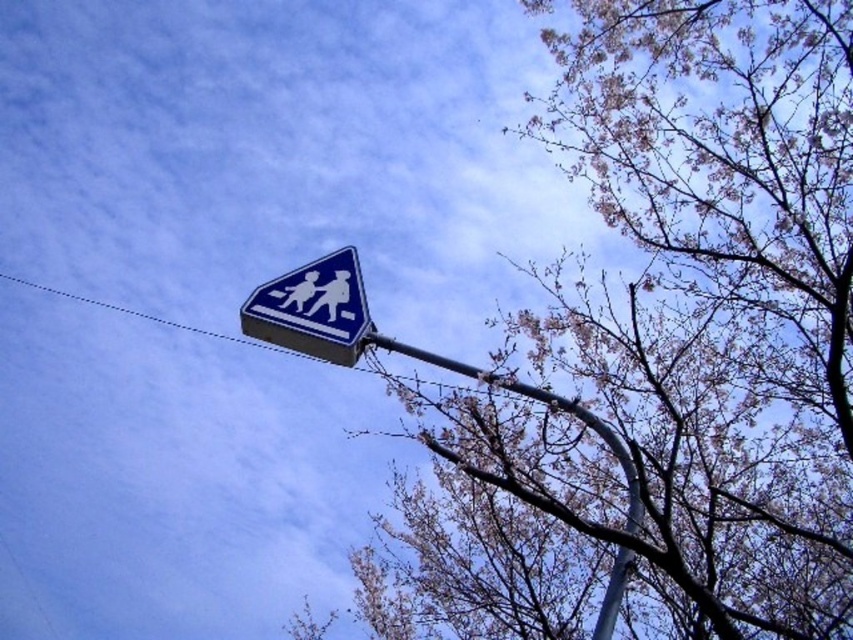
Is blue glossy pedestrian crossing sign at upper center to the left of metallic gray pole at upper center from the viewer's perspective?

Yes, blue glossy pedestrian crossing sign at upper center is to the left of metallic gray pole at upper center.

Does blue glossy pedestrian crossing sign at upper center lie in front of metallic gray pole at upper center?

No, it is not.

The width and height of the screenshot is (853, 640). What do you see at coordinates (312, 308) in the screenshot?
I see `blue glossy pedestrian crossing sign at upper center` at bounding box center [312, 308].

Where is `blue glossy pedestrian crossing sign at upper center`? The image size is (853, 640). blue glossy pedestrian crossing sign at upper center is located at coordinates (312, 308).

Measure the distance between bare branches at upper center and camera.

bare branches at upper center and camera are 9.08 meters apart from each other.

Describe the element at coordinates (660, 353) in the screenshot. I see `bare branches at upper center` at that location.

Identify the location of bare branches at upper center. (660, 353).

Can you confirm if bare branches at upper center is shorter than metallic gray pole at upper center?

No.

Is point (676, 305) more distant than point (444, 365)?

No, (676, 305) is in front of (444, 365).

You are a GUI agent. You are given a task and a screenshot of the screen. Output one action in this format:
    pyautogui.click(x=<x>, y=<y>)
    Task: Click on the bare branches at upper center
    This screenshot has width=853, height=640.
    Given the screenshot: What is the action you would take?
    pyautogui.click(x=660, y=353)